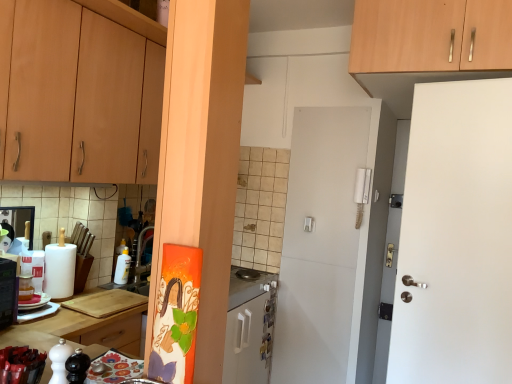
Image resolution: width=512 pixels, height=384 pixels. I want to click on vacant space situated above wooden cutting board at lower left (from a real-world perspective), so click(76, 306).